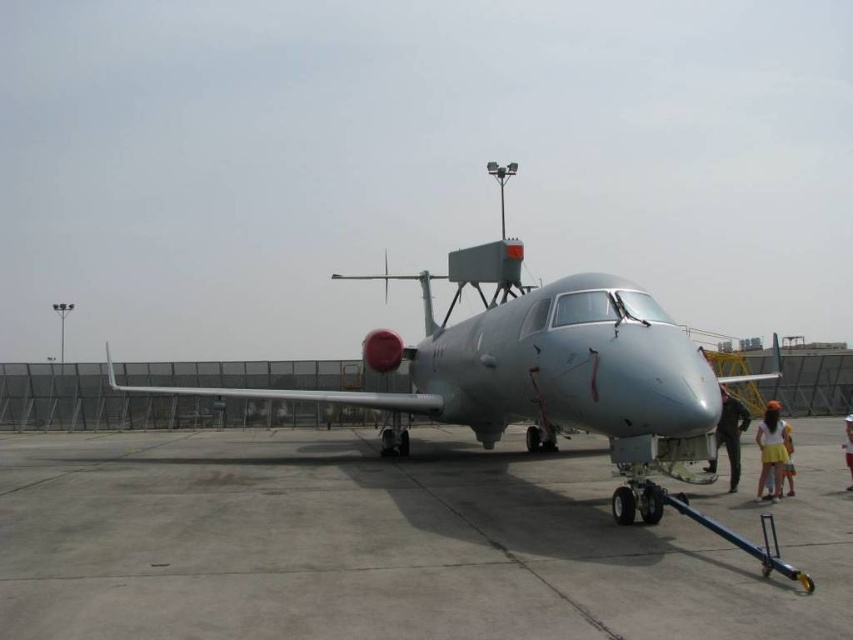
Question: Considering the relative positions of gray concrete tarmac at center and sleek metallic airplane at center in the image provided, where is gray concrete tarmac at center located with respect to sleek metallic airplane at center?

Choices:
 (A) right
 (B) left

Answer: (B)

Question: Which point is farther to the camera?

Choices:
 (A) (721, 400)
 (B) (791, 506)

Answer: (B)

Question: Is gray concrete tarmac at center to the left of white cotton shirt at center from the viewer's perspective?

Choices:
 (A) yes
 (B) no

Answer: (A)

Question: Does gray concrete tarmac at center appear on the right side of white cotton shirt at center?

Choices:
 (A) yes
 (B) no

Answer: (B)

Question: Which point appears farthest from the camera in this image?

Choices:
 (A) (708, 470)
 (B) (354, 486)
 (C) (772, 493)
 (D) (844, 440)

Answer: (D)

Question: Estimate the real-world distances between objects in this image. Which object is closer to the gray concrete tarmac at center?

Choices:
 (A) yellow fabric skirt at lower right
 (B) black fabric person at lower right

Answer: (B)